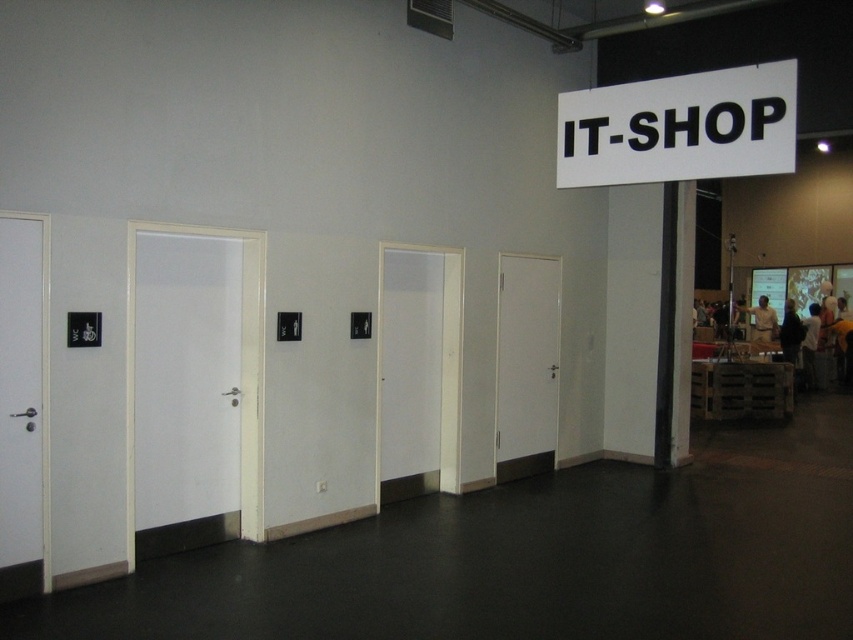
You are a visitor at the convention center and need to find the IT SHOP. You see two doors labeled as white matte door at left and white glossy door at left. Which door is closer to the IT SHOP sign?

The white glossy door at left is behind the white matte door at left, so the white matte door at left is closer to the IT SHOP sign.

In the scene shown: You are standing at the center of the scene. Which direction should you walk to reach the white matte door at left?

Since the white matte door at left is located at the left side of the scene, you should walk to the left to reach it.

You are standing in the convention center and need to locate the IT SHOP. There is a point marked at coordinates (x=679, y=128). What object is located at this point?

The point at coordinates (x=679, y=128) indicates a white plastic sign at upper center.